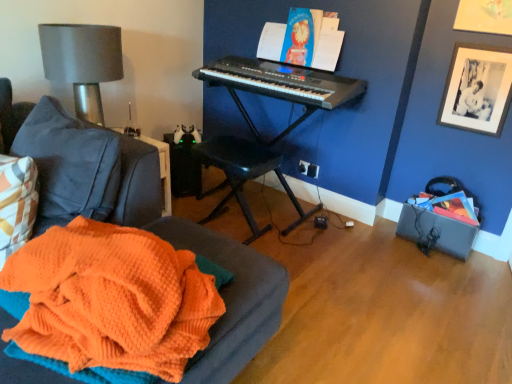
I want to click on free space between black plastic music stool at center and black plastic keyboard at center, so click(x=239, y=225).